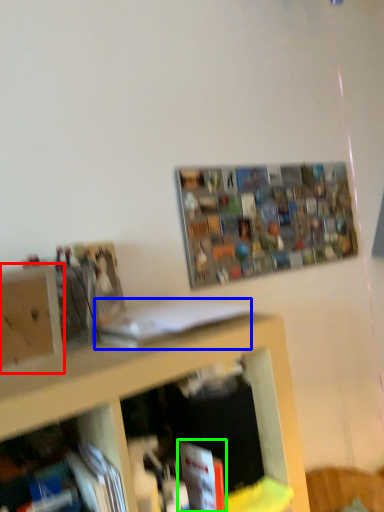
Question: Which object is positioned closest to cabinet (highlighted by a red box)? Select from book (highlighted by a blue box) and book (highlighted by a green box).

Choices:
 (A) book
 (B) book

Answer: (A)